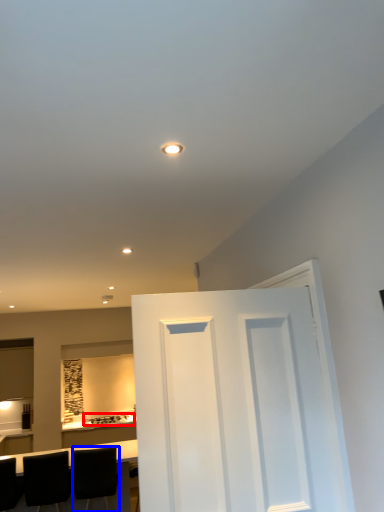
Question: Which point is further to the camera, appliance (highlighted by a red box) or chair (highlighted by a blue box)?

Choices:
 (A) appliance
 (B) chair

Answer: (A)